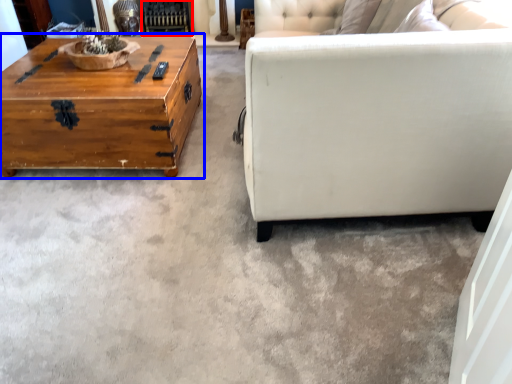
Question: Among these objects, which one is farthest to the camera, fireplace (highlighted by a red box) or coffee table (highlighted by a blue box)?

Choices:
 (A) fireplace
 (B) coffee table

Answer: (A)